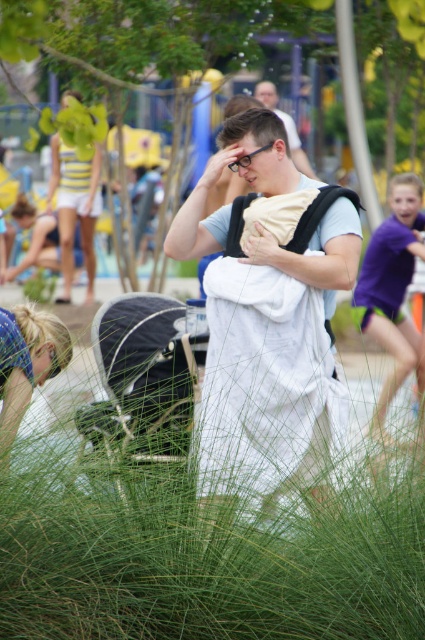
What do you see at coordinates (391, 285) in the screenshot? The height and width of the screenshot is (640, 425). I see `purple cotton shirt at right` at bounding box center [391, 285].

Between purple cotton shirt at right and matte black baby carrier at center, which one appears on the right side from the viewer's perspective?

purple cotton shirt at right

The height and width of the screenshot is (640, 425). Describe the element at coordinates (391, 285) in the screenshot. I see `purple cotton shirt at right` at that location.

I want to click on purple cotton shirt at right, so click(391, 285).

Who is shorter, green soft grass at center or white cotton baby carrier at center?

With less height is green soft grass at center.

Between green soft grass at center and white cotton baby carrier at center, which one is positioned lower?

green soft grass at center is below.

This screenshot has width=425, height=640. I want to click on green soft grass at center, so click(201, 556).

What do you see at coordinates (201, 556) in the screenshot?
I see `green soft grass at center` at bounding box center [201, 556].

Does point (138, 472) come behind point (266, 88)?

That is False.

Measure the distance between point (36, 497) and camera.

Point (36, 497) is 4.85 meters away from camera.

This screenshot has width=425, height=640. In order to click on green soft grass at center in this screenshot , I will do `click(201, 556)`.